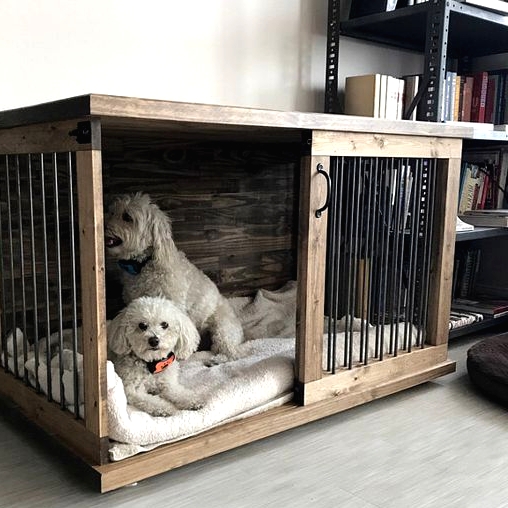
The image size is (508, 508). Find the location of `floor`. floor is located at coordinates click(308, 485), click(435, 449).